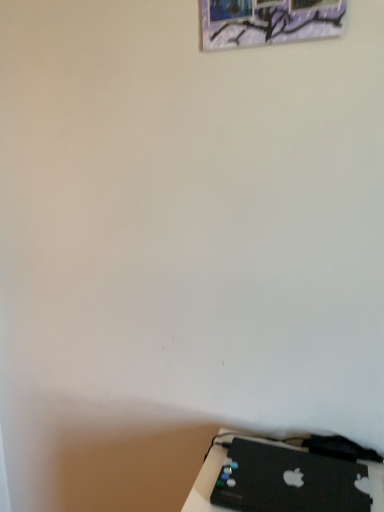
Question: Could you tell me if metallic silver picture frame at upper center is turned towards black matte laptop at lower right?

Choices:
 (A) yes
 (B) no

Answer: (B)

Question: Is metallic silver picture frame at upper center not within black matte laptop at lower right?

Choices:
 (A) no
 (B) yes

Answer: (B)

Question: Does metallic silver picture frame at upper center have a greater height compared to black matte laptop at lower right?

Choices:
 (A) yes
 (B) no

Answer: (A)

Question: Does metallic silver picture frame at upper center have a smaller size compared to black matte laptop at lower right?

Choices:
 (A) yes
 (B) no

Answer: (B)

Question: From a real-world perspective, is metallic silver picture frame at upper center positioned over black matte laptop at lower right based on gravity?

Choices:
 (A) no
 (B) yes

Answer: (B)

Question: From the image's perspective, does metallic silver picture frame at upper center appear higher than black matte laptop at lower right?

Choices:
 (A) yes
 (B) no

Answer: (A)

Question: Is metallic silver picture frame at upper center surrounded by black matte laptop at lower right?

Choices:
 (A) no
 (B) yes

Answer: (A)

Question: Considering the relative positions of black matte laptop at lower right and metallic silver picture frame at upper center in the image provided, is black matte laptop at lower right to the left of metallic silver picture frame at upper center from the viewer's perspective?

Choices:
 (A) no
 (B) yes

Answer: (A)

Question: Is the surface of black matte laptop at lower right in direct contact with metallic silver picture frame at upper center?

Choices:
 (A) no
 (B) yes

Answer: (A)

Question: From the image's perspective, is black matte laptop at lower right located beneath metallic silver picture frame at upper center?

Choices:
 (A) yes
 (B) no

Answer: (A)

Question: From a real-world perspective, is black matte laptop at lower right positioned under metallic silver picture frame at upper center based on gravity?

Choices:
 (A) yes
 (B) no

Answer: (A)

Question: Can you confirm if black matte laptop at lower right is bigger than metallic silver picture frame at upper center?

Choices:
 (A) yes
 (B) no

Answer: (B)

Question: Is black matte laptop at lower right wider or thinner than metallic silver picture frame at upper center?

Choices:
 (A) wide
 (B) thin

Answer: (A)